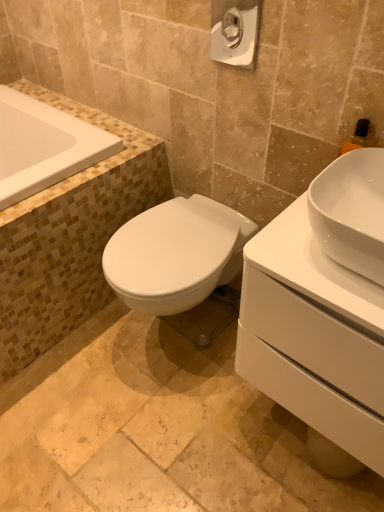
Where is `white glossy toilet paper at upper center`? The image size is (384, 512). white glossy toilet paper at upper center is located at coordinates (235, 32).

Identify the location of white glossy bathtub at upper left. (44, 146).

Does point (232, 30) come behind point (47, 179)?

No, it is in front of (47, 179).

Is white glossy toilet paper at upper center turned away from white glossy bathtub at upper left?

No, white glossy toilet paper at upper center is not facing away from white glossy bathtub at upper left.

Considering the sizes of objects white glossy toilet paper at upper center and white glossy bathtub at upper left in the image provided, who is smaller, white glossy toilet paper at upper center or white glossy bathtub at upper left?

With smaller size is white glossy toilet paper at upper center.

Is white glossy sink at right wider than white glossy toilet paper at upper center?

Yes.

Does white glossy sink at right have a greater height compared to white glossy toilet paper at upper center?

No, white glossy sink at right is not taller than white glossy toilet paper at upper center.

Looking at this image, does white glossy sink at right come in front of white glossy toilet paper at upper center?

Yes.

Between white glossy bathtub at upper left and white glossy sink at right, which one is positioned behind?

white glossy bathtub at upper left is more distant.

Considering the sizes of objects white glossy bathtub at upper left and white glossy sink at right in the image provided, who is taller, white glossy bathtub at upper left or white glossy sink at right?

white glossy sink at right is taller.

From the image's perspective, is white glossy bathtub at upper left on white glossy sink at right?

Correct, white glossy bathtub at upper left appears higher than white glossy sink at right in the image.

Is white glossy bathtub at upper left to the left of white glossy sink at right from the viewer's perspective?

Indeed, white glossy bathtub at upper left is positioned on the left side of white glossy sink at right.

Considering the positions of point (361, 424) and point (256, 48), is point (361, 424) closer or farther from the camera than point (256, 48)?

Clearly, point (361, 424) is closer to the camera than point (256, 48).

Does white glossy sink at right appear on the right side of white glossy toilet paper at upper center?

Correct, you'll find white glossy sink at right to the right of white glossy toilet paper at upper center.

Considering the sizes of white glossy sink at right and white glossy toilet paper at upper center in the image, is white glossy sink at right taller or shorter than white glossy toilet paper at upper center?

Considering their sizes, white glossy sink at right has more height than white glossy toilet paper at upper center.

Is white glossy bathtub at upper left inside white glossy sink at right?

That's incorrect, white glossy bathtub at upper left is not inside white glossy sink at right.

From a real-world perspective, which is physically below, white glossy sink at right or white glossy bathtub at upper left?

From a 3D spatial view, white glossy sink at right is below.

Considering their positions, is white glossy sink at right located in front of or behind white glossy bathtub at upper left?

white glossy sink at right is positioned closer to the viewer than white glossy bathtub at upper left.

Is white glossy sink at right not near white glossy bathtub at upper left?

No, there isn't a large distance between white glossy sink at right and white glossy bathtub at upper left.

Does white glossy bathtub at upper left turn towards white glossy toilet paper at upper center?

No, white glossy bathtub at upper left does not turn towards white glossy toilet paper at upper center.

Which of these two, white glossy bathtub at upper left or white glossy toilet paper at upper center, stands taller?

Standing taller between the two is white glossy toilet paper at upper center.

Are white glossy bathtub at upper left and white glossy toilet paper at upper center located far from each other?

No, white glossy bathtub at upper left is not far away from white glossy toilet paper at upper center.

Does white glossy bathtub at upper left appear on the right side of white glossy toilet paper at upper center?

Incorrect, white glossy bathtub at upper left is not on the right side of white glossy toilet paper at upper center.

Is white glossy toilet paper at upper center to the left of white glossy sink at right from the viewer's perspective?

Correct, you'll find white glossy toilet paper at upper center to the left of white glossy sink at right.

Which is correct: white glossy toilet paper at upper center is inside white glossy sink at right, or outside of it?

white glossy toilet paper at upper center is located beyond the bounds of white glossy sink at right.

Does white glossy toilet paper at upper center have a larger size compared to white glossy sink at right?

Actually, white glossy toilet paper at upper center might be smaller than white glossy sink at right.

From the image's perspective, is white glossy toilet paper at upper center below white glossy sink at right?

Incorrect, from the image's perspective, white glossy toilet paper at upper center is higher than white glossy sink at right.

This screenshot has width=384, height=512. What are the coordinates of `bathtub on the left of white glossy toilet paper at upper center` in the screenshot? It's located at 44,146.

Identify the location of sink on the right of white glossy toilet paper at upper center. pyautogui.click(x=351, y=211).

Estimate the real-world distances between objects in this image. Which object is further from white glossy toilet paper at upper center, white glossy bathtub at upper left or white glossy sink at right?

Based on the image, white glossy bathtub at upper left appears to be further to white glossy toilet paper at upper center.

Looking at the image, which one is located further to white glossy sink at right, white glossy sink at right or white glossy bathtub at upper left?

The object further to white glossy sink at right is white glossy bathtub at upper left.

Considering their positions, is white glossy sink at right positioned closer to white glossy sink at right than white glossy toilet paper at upper center?

white glossy sink at right is closer to white glossy sink at right.

Looking at this image, looking at the image, which one is located further to white glossy bathtub at upper left, white glossy sink at right or white glossy sink at right?

Based on the image, white glossy sink at right appears to be further to white glossy bathtub at upper left.

Considering their positions, is white glossy sink at right positioned closer to white glossy toilet paper at upper center than white glossy bathtub at upper left?

Among the two, white glossy sink at right is located nearer to white glossy toilet paper at upper center.

In the scene shown: Which object lies further to the anchor point white glossy sink at right, white glossy bathtub at upper left or white glossy sink at right?

The object further to white glossy sink at right is white glossy bathtub at upper left.

Consider the image. Looking at the image, which one is located further to white glossy sink at right, white glossy toilet paper at upper center or white glossy bathtub at upper left?

white glossy bathtub at upper left is positioned further to the anchor white glossy sink at right.

Estimate the real-world distances between objects in this image. Which object is closer to white glossy toilet paper at upper center, white glossy bathtub at upper left or white glossy sink at right?

white glossy sink at right is positioned closer to the anchor white glossy toilet paper at upper center.

Locate an element on the screen. This screenshot has height=512, width=384. toilet paper located between white glossy bathtub at upper left and white glossy sink at right in the left-right direction is located at coordinates pyautogui.click(x=235, y=32).

The width and height of the screenshot is (384, 512). I want to click on sink between white glossy bathtub at upper left and white glossy sink at right in the horizontal direction, so click(x=351, y=211).

Image resolution: width=384 pixels, height=512 pixels. In order to click on sink between white glossy toilet paper at upper center and white glossy sink at right in the up-down direction in this screenshot , I will do `click(351, 211)`.

At what (x,y) coordinates should I click in order to perform the action: click on toilet paper situated between white glossy bathtub at upper left and white glossy sink at right from left to right. Please return your answer as a coordinate pair (x, y). This screenshot has width=384, height=512. Looking at the image, I should click on (235, 32).